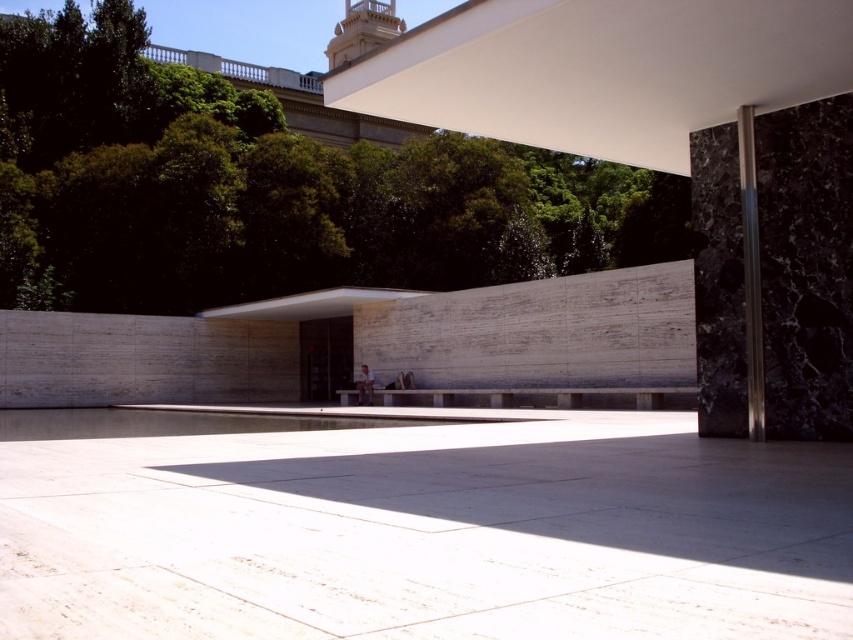
Question: Which object is closer to the camera taking this photo?

Choices:
 (A) green leafy tree at upper center
 (B) polished silver pole at right
 (C) white polished concrete at center

Answer: (C)

Question: Can you confirm if white polished concrete at center is positioned to the right of green leafy tree at upper center?

Choices:
 (A) yes
 (B) no

Answer: (A)

Question: From the image, what is the correct spatial relationship of white polished concrete at center in relation to polished silver pole at right?

Choices:
 (A) left
 (B) right

Answer: (A)

Question: Which object appears closest to the camera in this image?

Choices:
 (A) green leafy tree at upper center
 (B) white polished concrete at center
 (C) polished silver pole at right

Answer: (B)

Question: Does green leafy tree at upper center have a smaller size compared to polished silver pole at right?

Choices:
 (A) no
 (B) yes

Answer: (A)

Question: Which point is farther from the camera taking this photo?

Choices:
 (A) (0, 24)
 (B) (218, 572)
 (C) (753, 282)

Answer: (A)